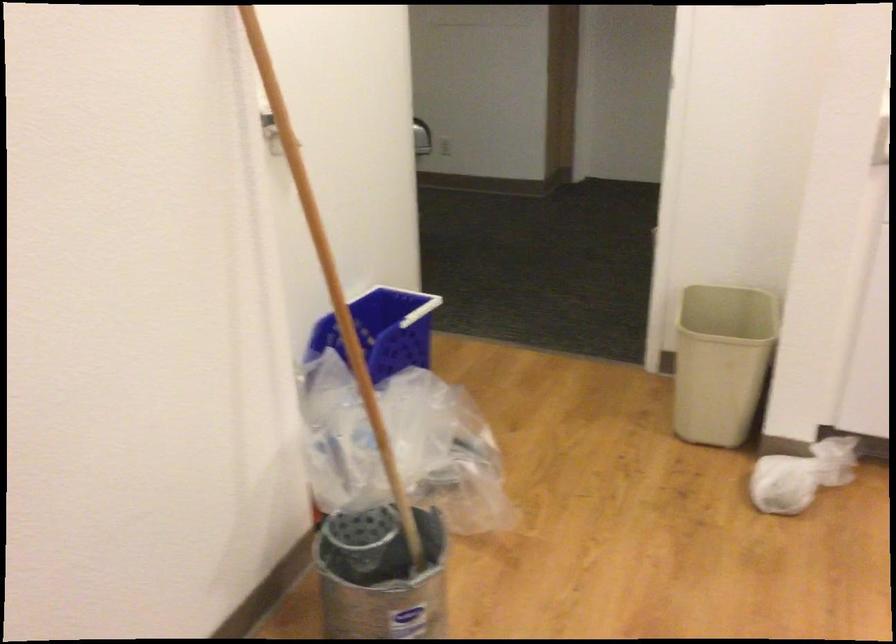
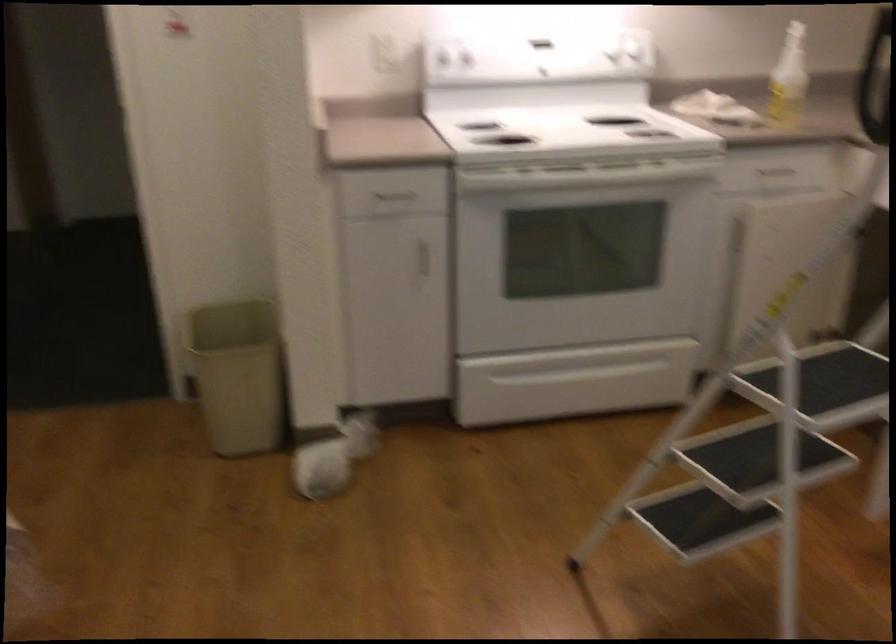
Question: The images are taken continuously from a first-person perspective. In which direction is your viewpoint rotating?

Choices:
 (A) Left
 (B) Right
 (C) Up
 (D) Down

Answer: (B)